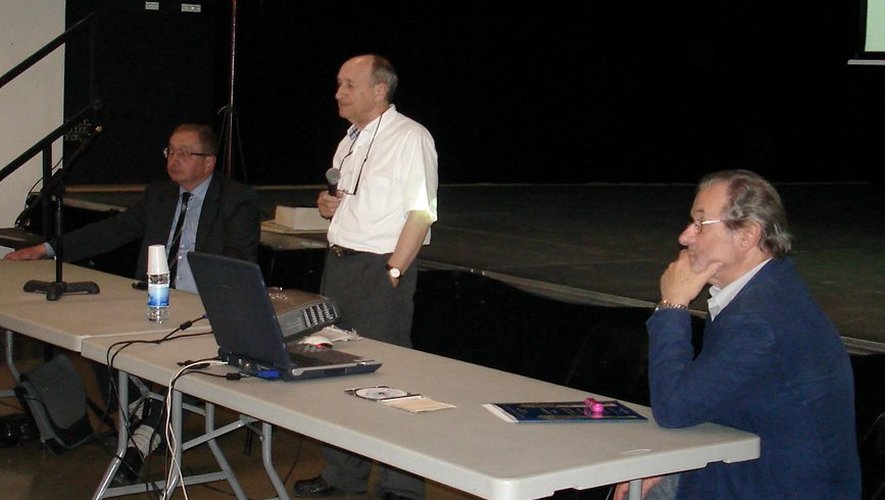
The width and height of the screenshot is (885, 500). Identify the location of stairs. (24, 235).